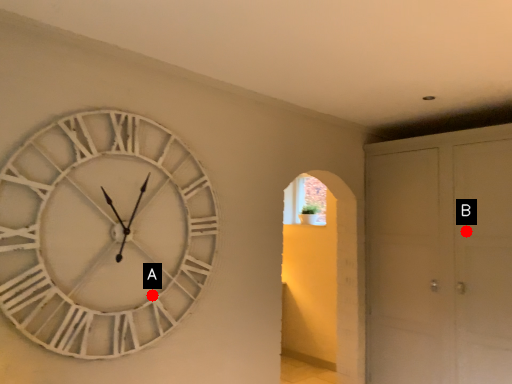
Question: Two points are circled on the image, labeled by A and B beside each circle. Which of the following is the farthest from the observer?

Choices:
 (A) A is further
 (B) B is further

Answer: (B)